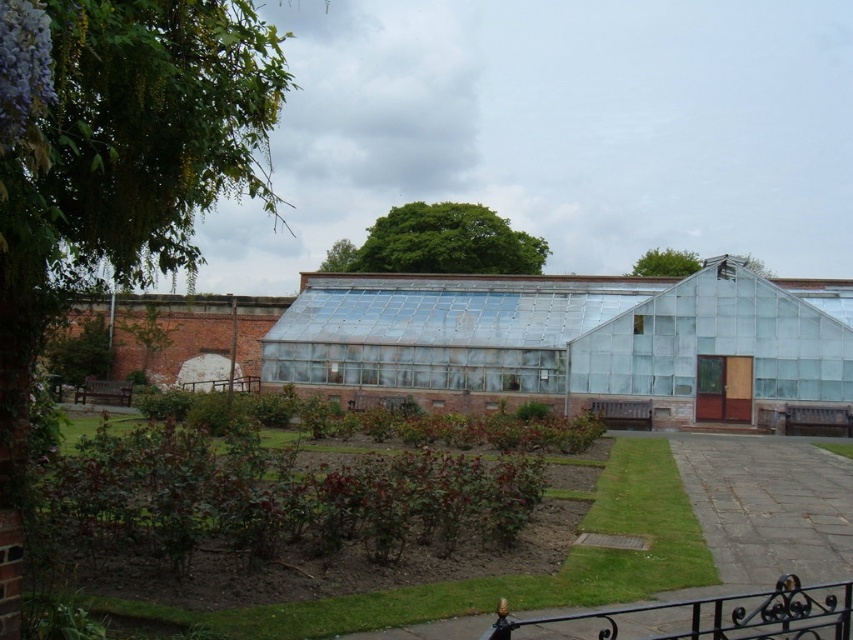
You are a gardener who wants to water the green leafy plants at center and the transparent glass conservatory at center. Since you have a limited amount of water, you need to prioritize which one is closer to you. Which object is positioned to the left, making it closer to your current position?

The green leafy plants at center is to the left of transparent glass conservatory at center, so it is closer to your current position.

You are standing in the garden looking at the greenhouse. There are two points marked in the image. The first point is at coordinate point (607, 497) and the second point is at coordinate point (816, 442). Which point is closer to you?

Point (607, 497) is closer to the camera than point (816, 442).